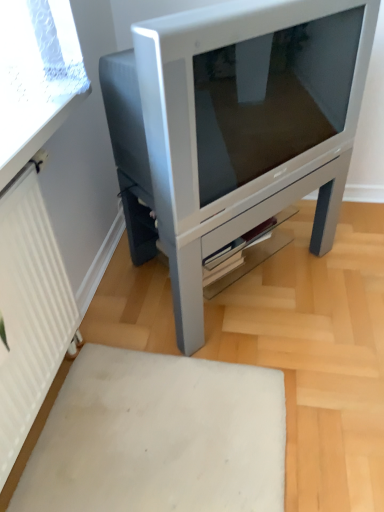
Question: From the image's perspective, would you say white ribbed radiator at left is positioned over white matte rug at lower center?

Choices:
 (A) no
 (B) yes

Answer: (B)

Question: Can you confirm if white ribbed radiator at left is thinner than white matte rug at lower center?

Choices:
 (A) yes
 (B) no

Answer: (A)

Question: Is white ribbed radiator at left touching white matte rug at lower center?

Choices:
 (A) no
 (B) yes

Answer: (A)

Question: Is white ribbed radiator at left taller than white matte rug at lower center?

Choices:
 (A) yes
 (B) no

Answer: (A)

Question: Does white ribbed radiator at left have a larger size compared to white matte rug at lower center?

Choices:
 (A) yes
 (B) no

Answer: (A)

Question: From the image's perspective, is white ribbed radiator at left positioned above or below white matte rug at lower center?

Choices:
 (A) above
 (B) below

Answer: (A)

Question: Would you say white ribbed radiator at left is inside or outside white matte rug at lower center?

Choices:
 (A) inside
 (B) outside

Answer: (B)

Question: Considering the positions of white ribbed radiator at left and white matte rug at lower center in the image, is white ribbed radiator at left taller or shorter than white matte rug at lower center?

Choices:
 (A) tall
 (B) short

Answer: (A)

Question: Is white ribbed radiator at left to the left or to the right of white matte rug at lower center in the image?

Choices:
 (A) right
 (B) left

Answer: (B)

Question: Is white matte rug at lower center in front of or behind satin silver television at center in the image?

Choices:
 (A) behind
 (B) front

Answer: (B)

Question: From a real-world perspective, relative to satin silver television at center, is white matte rug at lower center vertically above or below?

Choices:
 (A) above
 (B) below

Answer: (B)

Question: Considering the positions of point (266, 404) and point (139, 186), is point (266, 404) closer or farther from the camera than point (139, 186)?

Choices:
 (A) closer
 (B) farther

Answer: (A)

Question: In terms of width, does white matte rug at lower center look wider or thinner when compared to satin silver television at center?

Choices:
 (A) wide
 (B) thin

Answer: (A)

Question: In the image, is satin silver television at center positioned in front of or behind white ribbed radiator at left?

Choices:
 (A) behind
 (B) front

Answer: (A)

Question: From a real-world perspective, is satin silver television at center physically located above or below white ribbed radiator at left?

Choices:
 (A) above
 (B) below

Answer: (B)